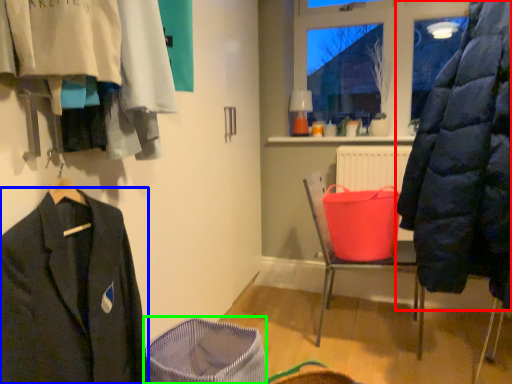
Question: Which object is positioned closest to coat (highlighted by a red box)? Select from suit (highlighted by a blue box) and basket container (highlighted by a green box).

Choices:
 (A) suit
 (B) basket container

Answer: (B)